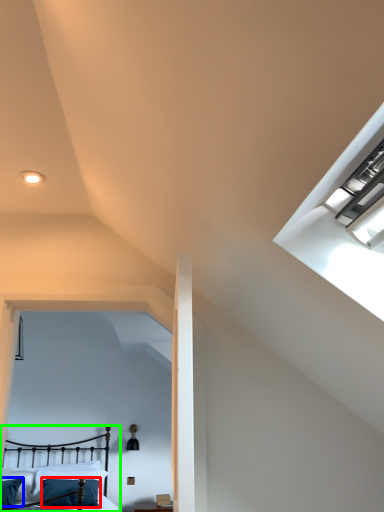
Question: Which object is the farthest from pillow (highlighted by a red box)? Choose among these: pillow (highlighted by a blue box) or bed (highlighted by a green box).

Choices:
 (A) pillow
 (B) bed

Answer: (A)